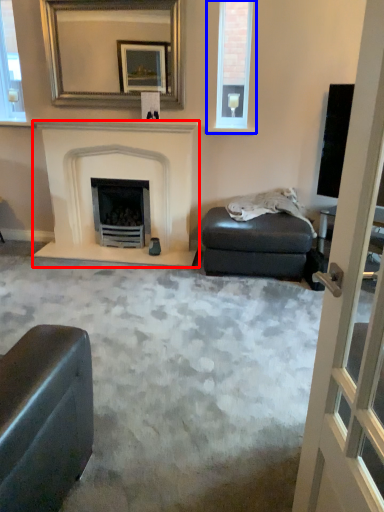
Question: Which of the following is the closest to the observer, fireplace (highlighted by a red box) or window (highlighted by a blue box)?

Choices:
 (A) fireplace
 (B) window

Answer: (A)